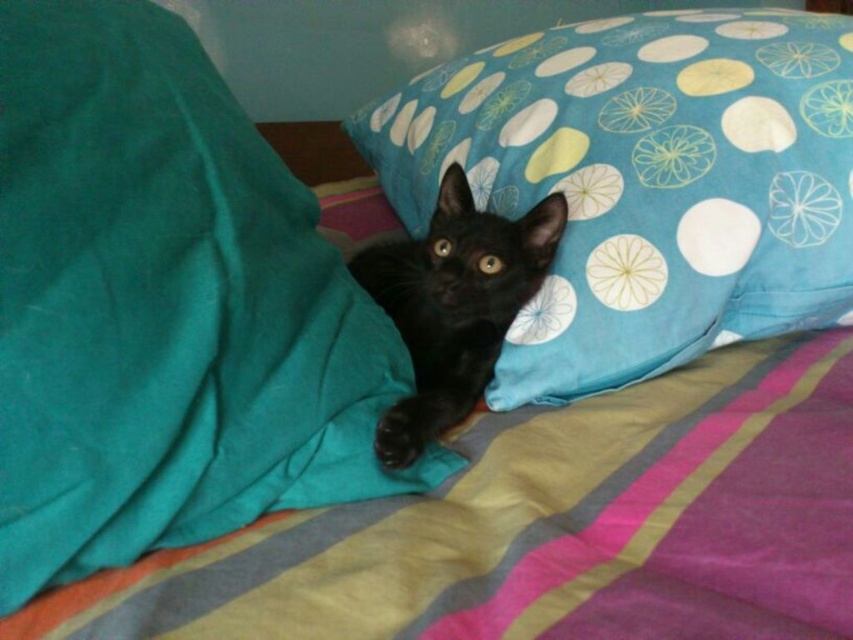
Can you confirm if blue dotted pillow at upper right is positioned below black glossy cat at center?

No.

Can you confirm if blue dotted pillow at upper right is taller than black glossy cat at center?

Indeed, blue dotted pillow at upper right has a greater height compared to black glossy cat at center.

You are a GUI agent. You are given a task and a screenshot of the screen. Output one action in this format:
    pyautogui.click(x=<x>, y=<y>)
    Task: Click on the blue dotted pillow at upper right
    The height and width of the screenshot is (640, 853).
    Given the screenshot: What is the action you would take?
    (643, 182)

Where is `blue dotted pillow at upper right`? blue dotted pillow at upper right is located at coordinates (643, 182).